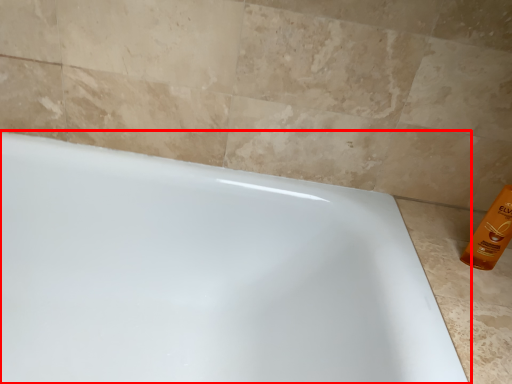
Question: From the image's perspective, what is the correct spatial positioning of bathtub (annotated by the red box) in reference to cleaning product?

Choices:
 (A) above
 (B) below

Answer: (B)